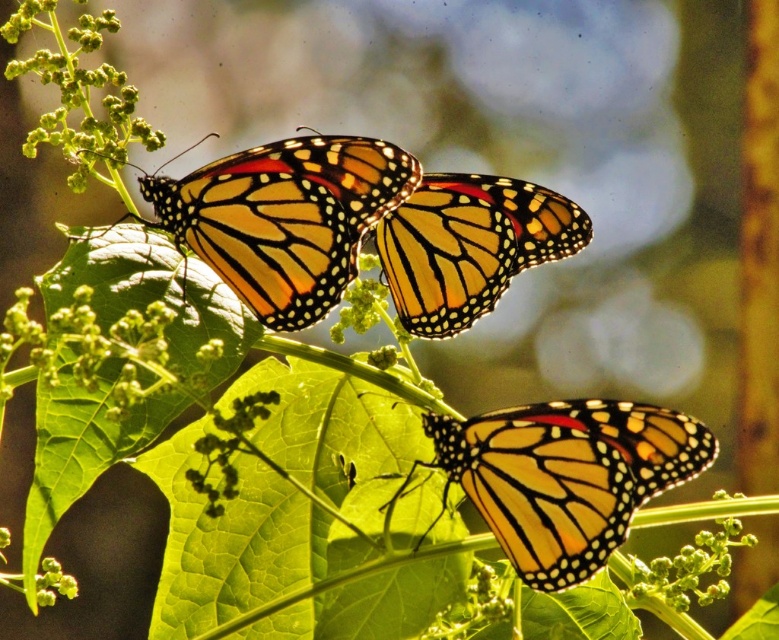
Is orange and black spotted wings at upper left positioned before green fuzzy plant at upper left?

Yes.

Which is behind, point (241, 244) or point (9, 64)?

Point (9, 64)

At what (x,y) coordinates should I click in order to perform the action: click on orange and black spotted wings at upper left. Please return your answer as a coordinate pair (x, y). Looking at the image, I should click on (284, 218).

Who is positioned more to the right, yellow-orange wings at center or orange and black spotted wings at upper left?

yellow-orange wings at center is more to the right.

Can you confirm if yellow-orange wings at center is positioned below orange and black spotted wings at upper left?

Correct, yellow-orange wings at center is located below orange and black spotted wings at upper left.

Is point (540, 525) farther from camera compared to point (288, 284)?

Yes, it is behind point (288, 284).

Locate an element on the screen. yellow-orange wings at center is located at coordinates (562, 476).

Can you confirm if yellow-orange wings at center is positioned below green matte flower at center?

Correct, yellow-orange wings at center is located below green matte flower at center.

Is point (548, 492) behind point (346, 314)?

No, it is not.

Where is `yellow-orange wings at center`? Image resolution: width=779 pixels, height=640 pixels. yellow-orange wings at center is located at coordinates (562, 476).

The height and width of the screenshot is (640, 779). What are the coordinates of `yellow-orange wings at center` in the screenshot? It's located at (562, 476).